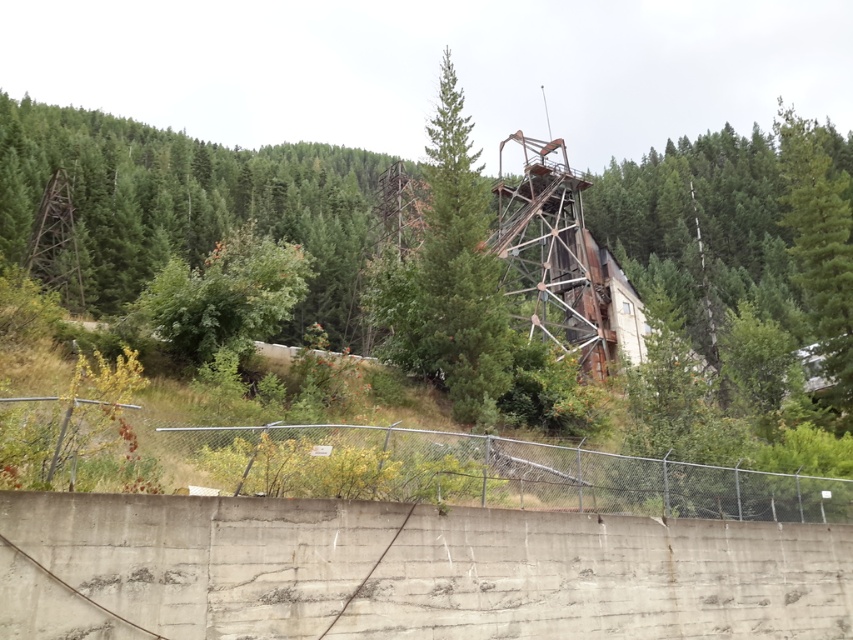
Question: Which point is farther to the camera?

Choices:
 (A) (238, 433)
 (B) (311, 308)
 (C) (821, 131)

Answer: (B)

Question: Which object appears closest to the camera in this image?

Choices:
 (A) metal chain-link fence at center
 (B) green matte tree at center
 (C) green matte tree at upper right

Answer: (A)

Question: Is rusty metal structure at center thinner than metal chain-link fence at center?

Choices:
 (A) no
 (B) yes

Answer: (A)

Question: Does rusty metal structure at center have a smaller size compared to metal chain-link fence at center?

Choices:
 (A) yes
 (B) no

Answer: (B)

Question: Is green matte tree at center bigger than green matte tree at upper right?

Choices:
 (A) no
 (B) yes

Answer: (A)

Question: Among these points, which one is nearest to the camera?

Choices:
 (A) (701, 285)
 (B) (366, 451)
 (C) (422, 356)

Answer: (B)